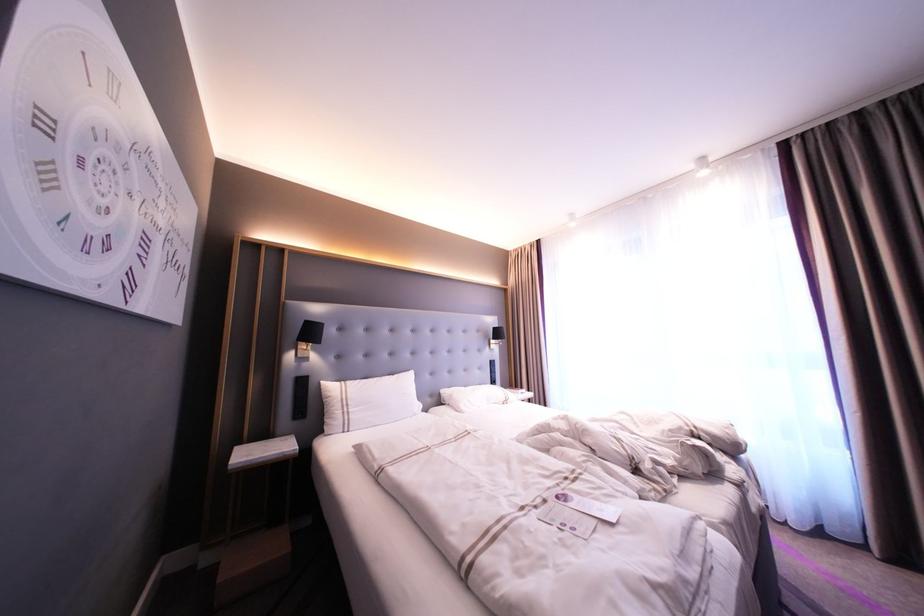
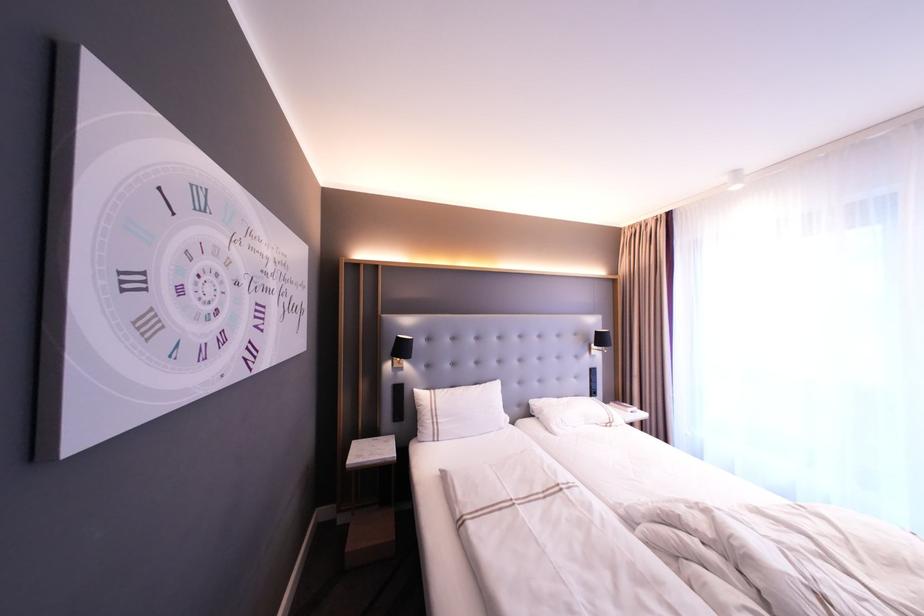
Locate, in the second image, the point that corresponds to point (462, 407) in the first image.

(553, 427)